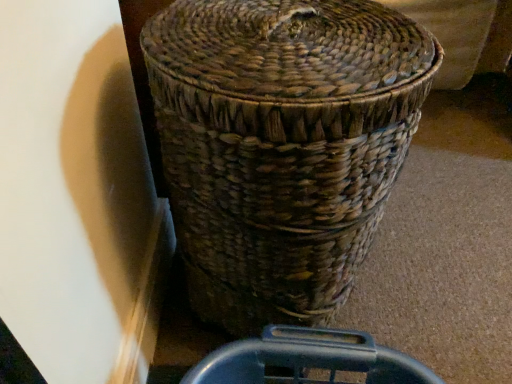
You are a GUI agent. You are given a task and a screenshot of the screen. Output one action in this format:
    pyautogui.click(x=<x>, y=<y>)
    Task: Click on the woven brown basket at center
    
    Given the screenshot: What is the action you would take?
    pyautogui.click(x=282, y=145)

Describe the element at coordinates (282, 145) in the screenshot. I see `woven brown basket at center` at that location.

Where is `woven brown basket at center`? Image resolution: width=512 pixels, height=384 pixels. woven brown basket at center is located at coordinates (282, 145).